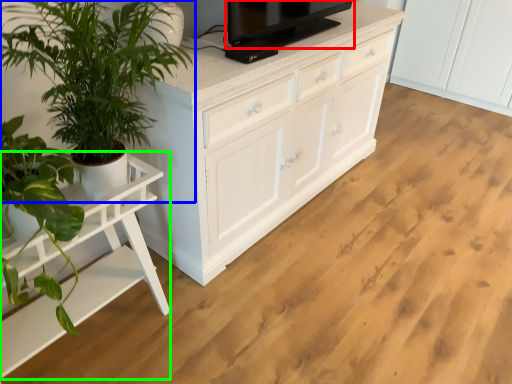
Question: Estimate the real-world distances between objects in this image. Which object is farther from television (highlighted by a red box), houseplant (highlighted by a blue box) or table (highlighted by a green box)?

Choices:
 (A) houseplant
 (B) table

Answer: (B)